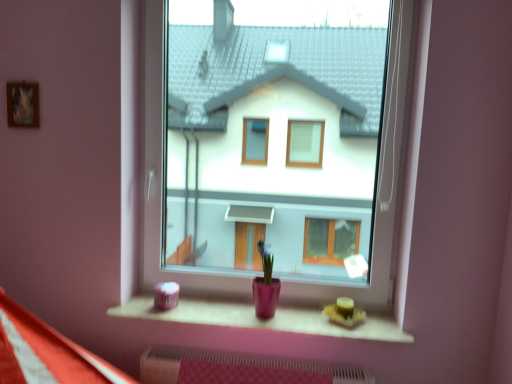
The height and width of the screenshot is (384, 512). I want to click on transparent glass window at center, so click(275, 150).

What do you see at coordinates (266, 320) in the screenshot? This screenshot has height=384, width=512. I see `matte pink wood at lower center` at bounding box center [266, 320].

In the scene shown: Measure the distance between point (249, 307) and camera.

The distance of point (249, 307) from camera is 6.42 feet.

Measure the distance between wooden frame at upper left and camera.

A distance of 5.71 feet exists between wooden frame at upper left and camera.

Describe the element at coordinates (23, 104) in the screenshot. The image size is (512, 384). I see `wooden frame at upper left` at that location.

In order to click on transparent glass window at center in this screenshot , I will do `click(275, 150)`.

Choose the correct answer: Is wooden frame at upper left inside transparent glass window at center or outside it?

wooden frame at upper left is not inside transparent glass window at center, it's outside.

Are wooden frame at upper left and transparent glass window at center beside each other?

No, wooden frame at upper left is not making contact with transparent glass window at center.

Between wooden frame at upper left and transparent glass window at center, which one has smaller size?

wooden frame at upper left is smaller.

Which point is more distant from viewer, (34, 92) or (285, 265)?

The point (285, 265) is farther from the camera.

From the image's perspective, which is above, transparent glass window at center or wooden frame at upper left?

wooden frame at upper left appears higher in the image.

Between transparent glass window at center and wooden frame at upper left, which one has smaller size?

wooden frame at upper left is smaller.

Between transparent glass window at center and wooden frame at upper left, which one has smaller width?

wooden frame at upper left is thinner.

In the scene shown: In terms of size, does transparent glass window at center appear bigger or smaller than matte pink wood at lower center?

Considering their sizes, transparent glass window at center takes up more space than matte pink wood at lower center.

Is point (285, 195) positioned in front of point (166, 319)?

No, (285, 195) is further to viewer.

Between transparent glass window at center and matte pink wood at lower center, which one appears on the right side from the viewer's perspective?

Positioned to the right is transparent glass window at center.

Is transparent glass window at center looking in the opposite direction of matte pink wood at lower center?

That's not correct — transparent glass window at center is not looking away from matte pink wood at lower center.

Considering the positions of objects wooden frame at upper left and matte pink wood at lower center in the image provided, who is in front, wooden frame at upper left or matte pink wood at lower center?

matte pink wood at lower center is in front.

Considering the points (11, 89) and (161, 313), which point is in front, point (11, 89) or point (161, 313)?

Positioned in front is point (11, 89).

Which is correct: wooden frame at upper left is inside matte pink wood at lower center, or outside of it?

wooden frame at upper left lies outside matte pink wood at lower center.

Does wooden frame at upper left have a greater height compared to matte pink wood at lower center?

Correct, wooden frame at upper left is much taller as matte pink wood at lower center.

In the scene shown: From the image's perspective, is matte pink wood at lower center beneath transparent glass window at center?

Correct, matte pink wood at lower center appears lower than transparent glass window at center in the image.

Identify the location of window sill on the left of transparent glass window at center. (266, 320).

Considering the relative positions of matte pink wood at lower center and transparent glass window at center in the image provided, is matte pink wood at lower center to the left or to the right of transparent glass window at center?

From the image, it's evident that matte pink wood at lower center is to the left of transparent glass window at center.

Is matte pink wood at lower center located outside wooden frame at upper left?

Absolutely, matte pink wood at lower center is external to wooden frame at upper left.

Is matte pink wood at lower center wider or thinner than wooden frame at upper left?

matte pink wood at lower center is wider than wooden frame at upper left.

Between matte pink wood at lower center and wooden frame at upper left, which one is positioned in front?

matte pink wood at lower center is in front.

From the image's perspective, is matte pink wood at lower center beneath wooden frame at upper left?

Yes.

Where is `picture frame above the transparent glass window at center (from the image's perspective)`? This screenshot has height=384, width=512. picture frame above the transparent glass window at center (from the image's perspective) is located at coordinates (23, 104).

Locate an element on the screen. picture frame lying behind the transparent glass window at center is located at coordinates (23, 104).

Estimate the real-world distances between objects in this image. Which object is closer to wooden frame at upper left, transparent glass window at center or matte pink wood at lower center?

matte pink wood at lower center lies closer to wooden frame at upper left than the other object.

Estimate the real-world distances between objects in this image. Which object is further from matte pink wood at lower center, wooden frame at upper left or transparent glass window at center?

Based on the image, transparent glass window at center appears to be further to matte pink wood at lower center.

Estimate the real-world distances between objects in this image. Which object is closer to matte pink wood at lower center, transparent glass window at center or wooden frame at upper left?

wooden frame at upper left.

Based on their spatial positions, is matte pink wood at lower center or wooden frame at upper left further from transparent glass window at center?

wooden frame at upper left lies further to transparent glass window at center than the other object.

Considering their positions, is matte pink wood at lower center positioned closer to wooden frame at upper left than transparent glass window at center?

matte pink wood at lower center is positioned closer to the anchor wooden frame at upper left.

Looking at the image, which one is located further to transparent glass window at center, wooden frame at upper left or matte pink wood at lower center?

wooden frame at upper left is positioned further to the anchor transparent glass window at center.

Find the location of a particular element. window sill between wooden frame at upper left and transparent glass window at center from left to right is located at coordinates (266, 320).